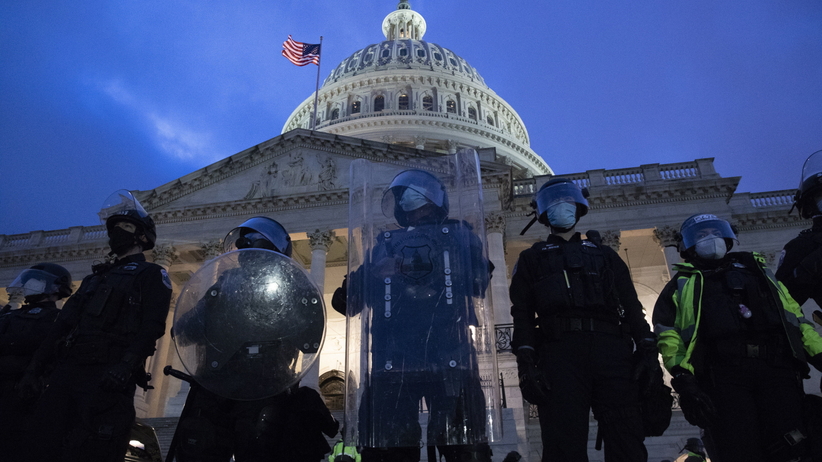
Locate an element on the screen. The height and width of the screenshot is (462, 822). window is located at coordinates (445, 102).